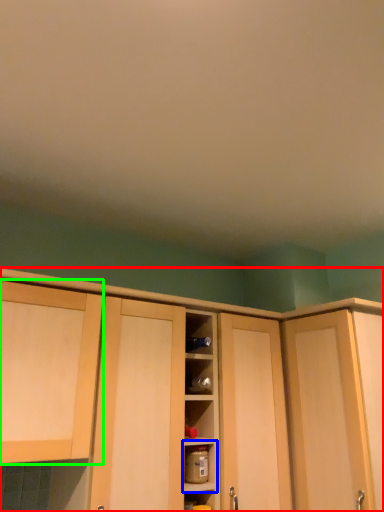
Question: Which object is positioned closest to cabinetry (highlighted by a red box)? Select from shelf (highlighted by a blue box) and cabinetry (highlighted by a green box).

Choices:
 (A) shelf
 (B) cabinetry

Answer: (B)